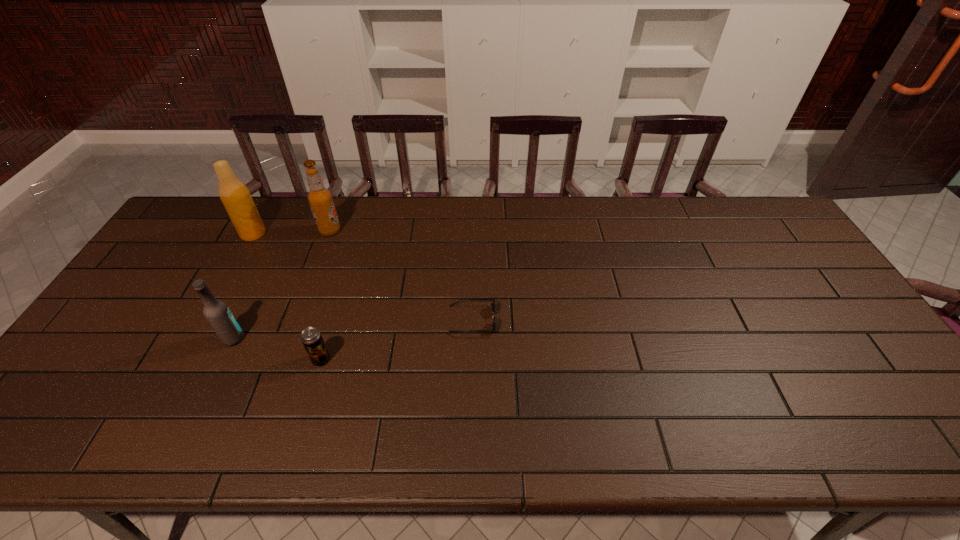
Identify the location of unoccupied position between the rightmost beer bottle and the leftmost object. (292, 232).

This screenshot has width=960, height=540. I want to click on free space between the fourth object from right to left and the fourth object from left to right, so click(x=277, y=349).

Find the location of a particular element. The height and width of the screenshot is (540, 960). free area in between the shortest object and the leftmost beer bottle is located at coordinates (363, 276).

This screenshot has height=540, width=960. What are the coordinates of `empty space that is in between the leftmost beer bottle and the fourth object from left to right` in the screenshot? It's located at (287, 296).

Identify the location of free space between the rightmost beer bottle and the beer can. This screenshot has width=960, height=540. (325, 295).

Where is `free space between the third object from left to right and the second object from right to left`? free space between the third object from left to right and the second object from right to left is located at coordinates (325, 295).

Where is `free space between the sunglasses and the rightmost beer bottle`? The height and width of the screenshot is (540, 960). free space between the sunglasses and the rightmost beer bottle is located at coordinates (401, 275).

At what (x,y) coordinates should I click in order to perform the action: click on free space between the fourth tallest object and the rightmost object. Please return your answer as a coordinate pair (x, y). Image resolution: width=960 pixels, height=540 pixels. Looking at the image, I should click on (396, 340).

This screenshot has width=960, height=540. I want to click on object that stands as the fourth closest to the beer can, so pos(234,194).

Choose which object is the third nearest neighbor to the fourth object from left to right. Please provide its 2D coordinates. Your answer should be formatted as a tuple, i.e. [(x, y)], where the tuple contains the x and y coordinates of a point satisfying the conditions above.

[(320, 199)]